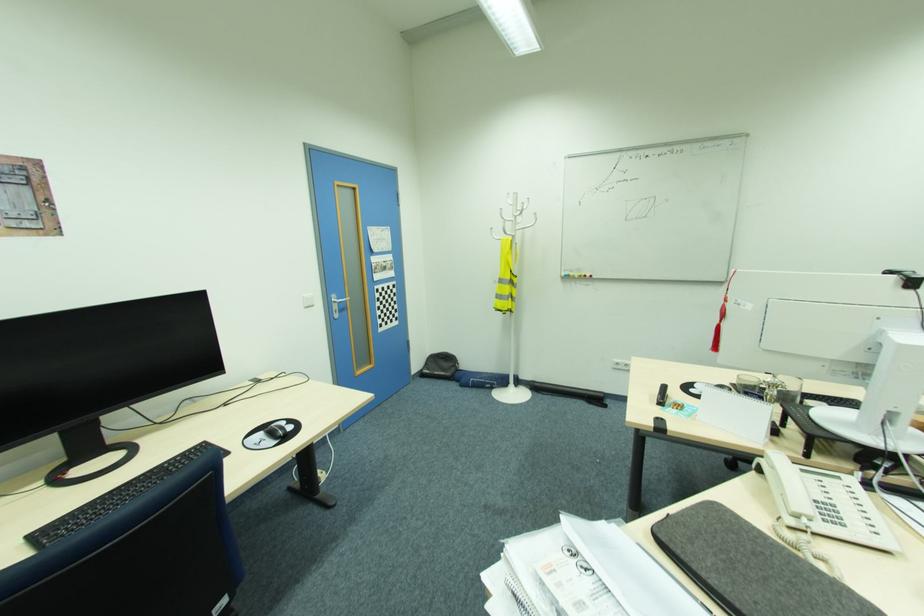
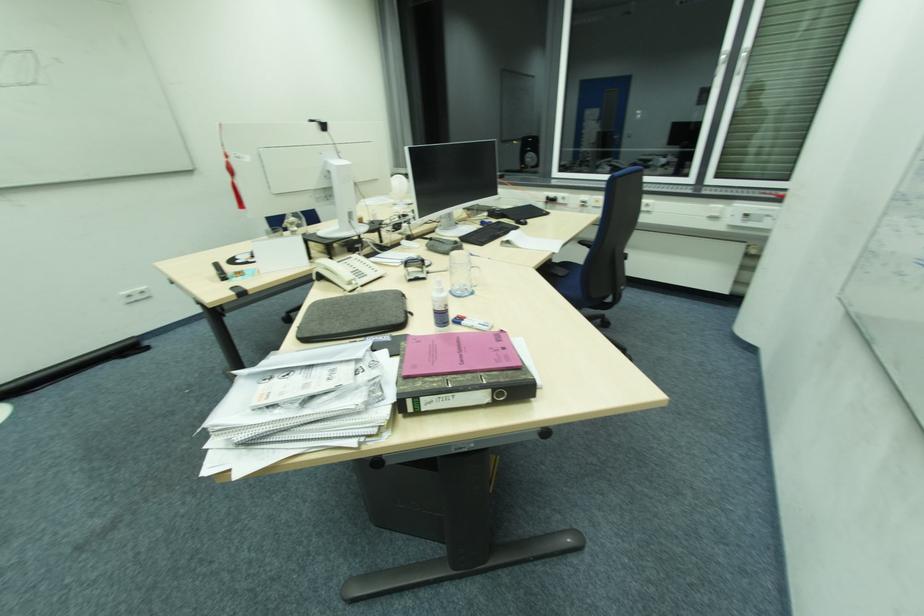
Based on the photo, how did the camera likely rotate?

The rotation direction of the camera is right-down.